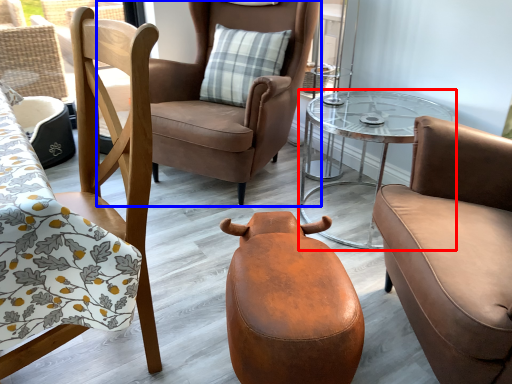
Question: Which object appears farthest to the camera in this image, table (highlighted by a red box) or chair (highlighted by a blue box)?

Choices:
 (A) table
 (B) chair

Answer: (B)